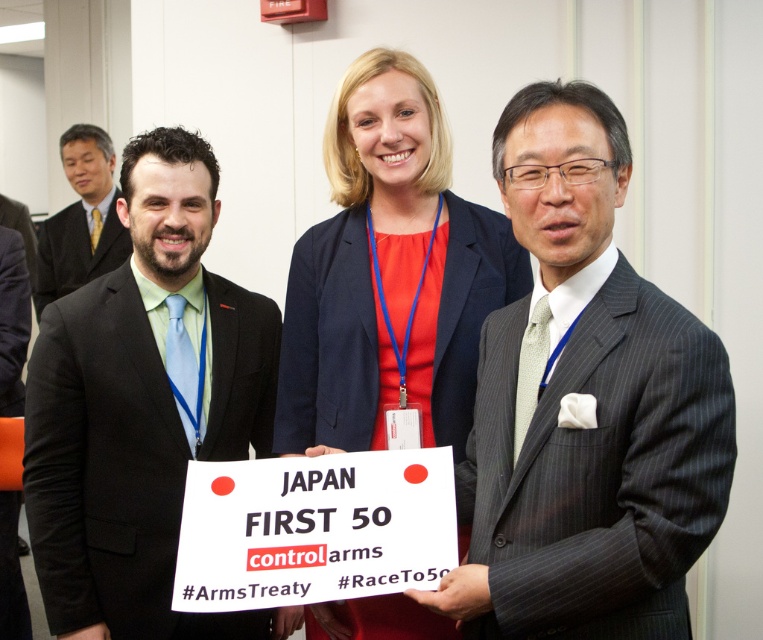
Question: Which of the following is the closest to the observer?

Choices:
 (A) black suit at left
 (B) gray pinstripe suit at right
 (C) white paper sign at center
 (D) matte blue blazer at center

Answer: (B)

Question: Does black suit at left appear on the right side of matte black suit at left?

Choices:
 (A) yes
 (B) no

Answer: (A)

Question: Does black suit at left have a greater width compared to white paper sign at center?

Choices:
 (A) no
 (B) yes

Answer: (B)

Question: Which point appears closest to the camera in this image?

Choices:
 (A) (584, 467)
 (B) (188, 544)
 (C) (375, 120)

Answer: (A)

Question: Can you confirm if gray pinstripe suit at right is positioned below matte blue blazer at center?

Choices:
 (A) yes
 (B) no

Answer: (A)

Question: Which of these objects is positioned closest to the white paper sign at center?

Choices:
 (A) black suit at left
 (B) matte black suit at left
 (C) gray pinstripe suit at right
 (D) matte blue blazer at center

Answer: (C)